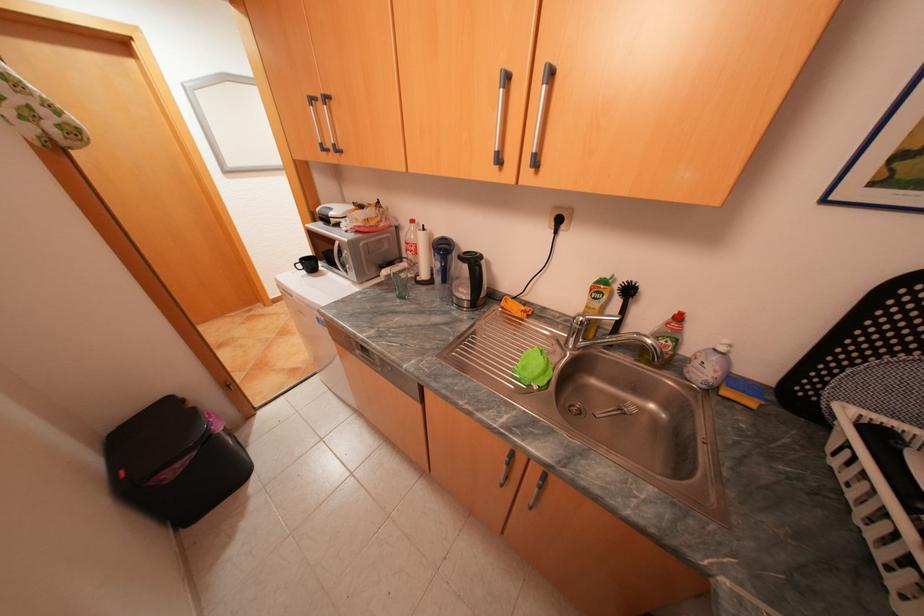
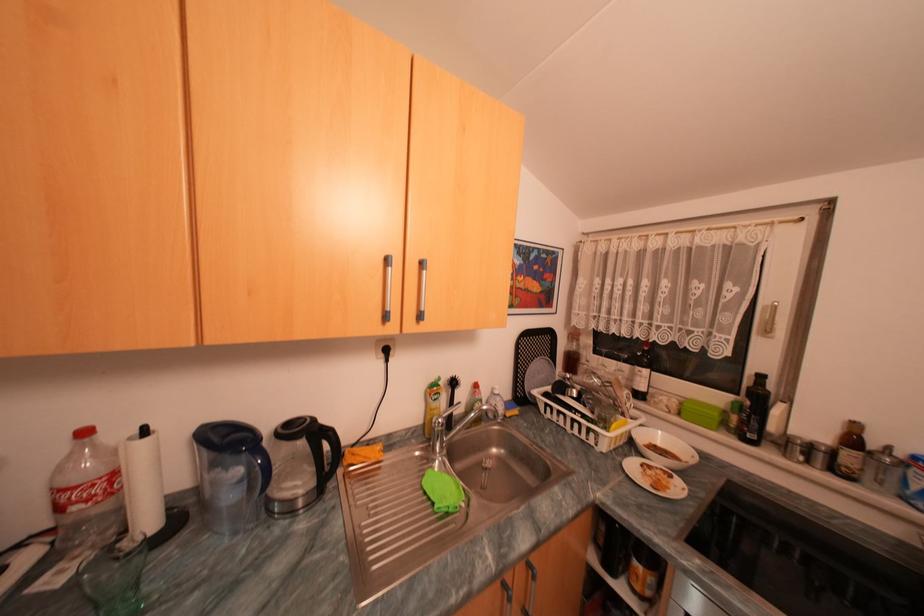
Locate, in the second image, the point that corresponds to the point at 421,221 in the first image.

(94, 432)